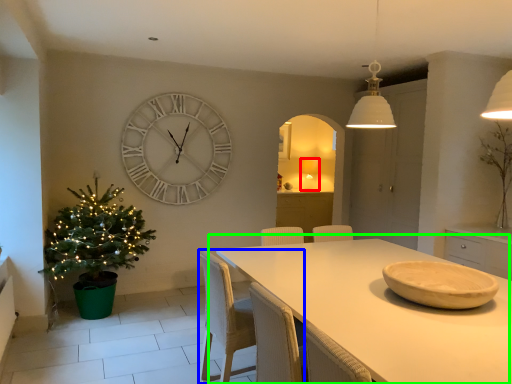
Question: Based on their relative distances, which object is nearer to lamp (highlighted by a red box)? Choose from chair (highlighted by a blue box) and table (highlighted by a green box).

Choices:
 (A) chair
 (B) table

Answer: (B)